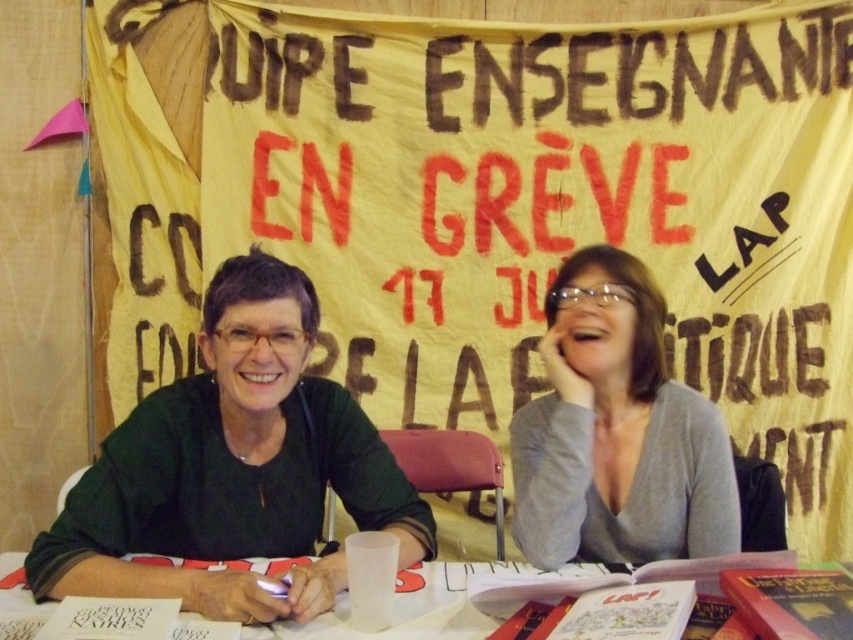
Question: Which object is closer to the camera taking this photo?

Choices:
 (A) gray matte sweater at center
 (B) white plastic table at center

Answer: (B)

Question: Which of the following is the closest to the observer?

Choices:
 (A) white plastic table at center
 (B) green matte shirt at center
 (C) gray matte sweater at center

Answer: (A)

Question: Is gray matte sweater at center further to camera compared to white plastic table at center?

Choices:
 (A) yes
 (B) no

Answer: (A)

Question: Can you confirm if green matte shirt at center is thinner than white plastic table at center?

Choices:
 (A) yes
 (B) no

Answer: (A)

Question: Is gray matte sweater at center above white plastic table at center?

Choices:
 (A) yes
 (B) no

Answer: (A)

Question: Which point is farther to the camera?

Choices:
 (A) (413, 593)
 (B) (670, 497)

Answer: (B)